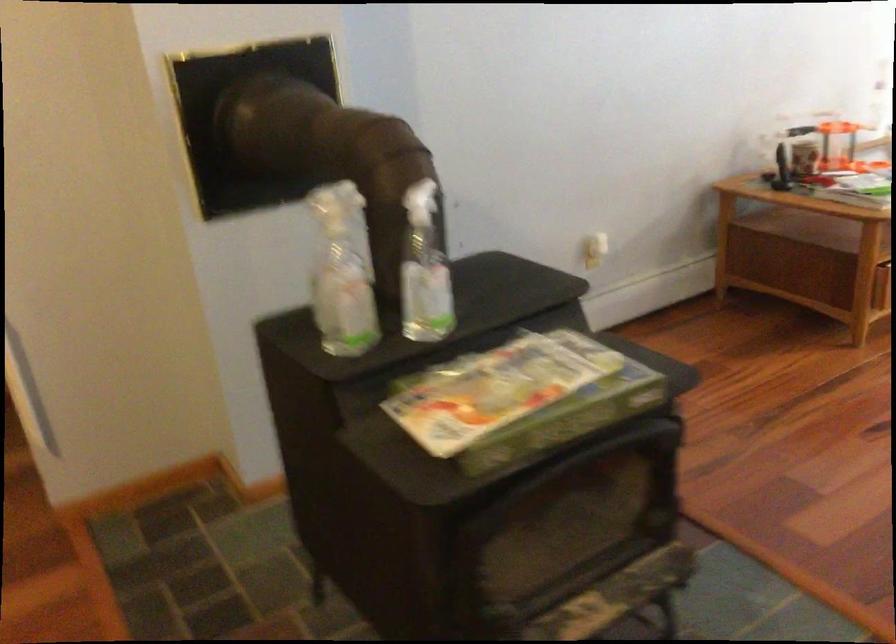
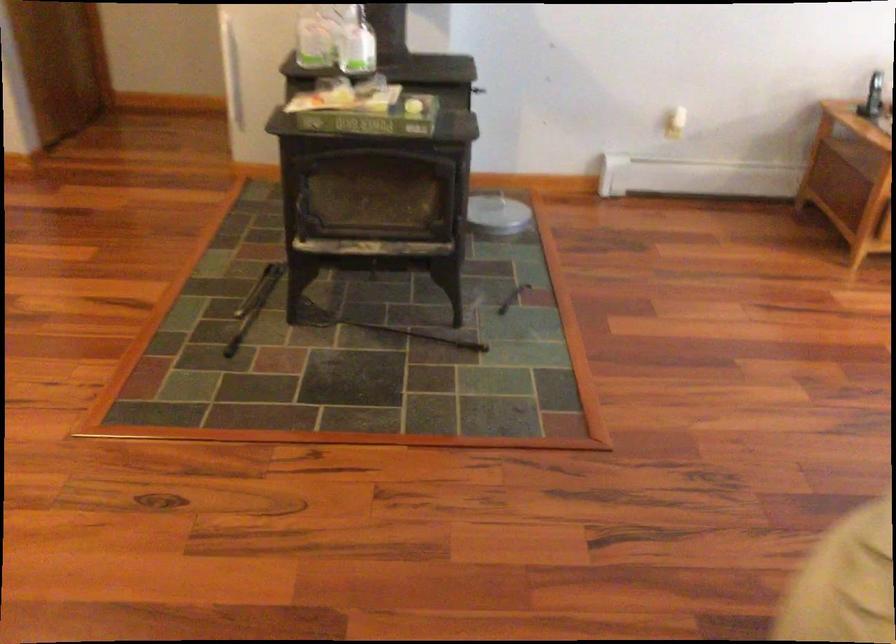
Where in the second image is the point corresponding to (576,409) from the first image?

(366, 116)